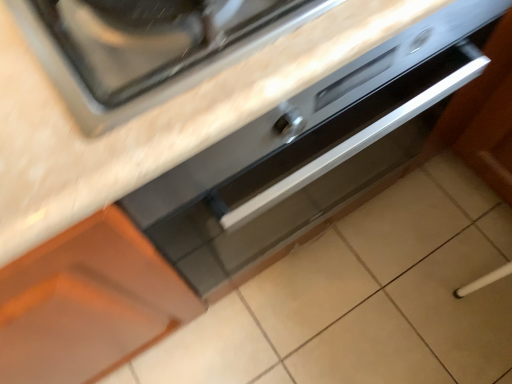
At what (x,y) coordinates should I click in order to perform the action: click on beige ceramic tile at lower right. Please return your answer as a coordinate pair (x, y). The width and height of the screenshot is (512, 384). Looking at the image, I should click on (460, 308).

What do you see at coordinates (460, 308) in the screenshot?
I see `beige ceramic tile at lower right` at bounding box center [460, 308].

The height and width of the screenshot is (384, 512). I want to click on beige ceramic tile at lower right, so click(460, 308).